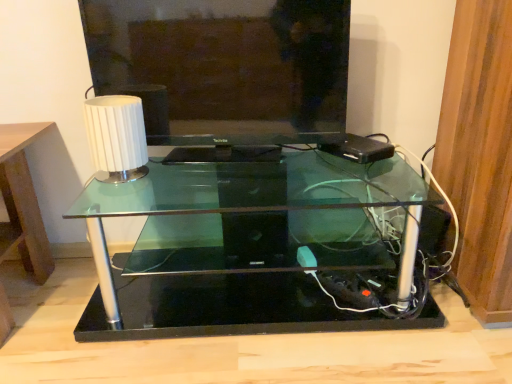
Question: Could you tell me if transparent glass table at center is facing white ribbed lampshade at upper left?

Choices:
 (A) yes
 (B) no

Answer: (B)

Question: From the image's perspective, is transparent glass table at center under white ribbed lampshade at upper left?

Choices:
 (A) no
 (B) yes

Answer: (B)

Question: Is the position of transparent glass table at center more distant than that of white ribbed lampshade at upper left?

Choices:
 (A) no
 (B) yes

Answer: (A)

Question: Can you confirm if transparent glass table at center is thinner than white ribbed lampshade at upper left?

Choices:
 (A) no
 (B) yes

Answer: (A)

Question: Is white ribbed lampshade at upper left at the back of transparent glass table at center?

Choices:
 (A) no
 (B) yes

Answer: (A)

Question: Is white ribbed lampshade at upper left inside transparent glass table at center?

Choices:
 (A) no
 (B) yes

Answer: (A)

Question: Would you say matte black television at center is outside transparent glass table at center?

Choices:
 (A) yes
 (B) no

Answer: (A)

Question: Does matte black television at center have a larger size compared to transparent glass table at center?

Choices:
 (A) no
 (B) yes

Answer: (A)

Question: Is matte black television at center not near transparent glass table at center?

Choices:
 (A) yes
 (B) no

Answer: (B)

Question: Can you confirm if matte black television at center is positioned to the right of transparent glass table at center?

Choices:
 (A) yes
 (B) no

Answer: (B)

Question: Could transparent glass table at center be considered to be inside matte black television at center?

Choices:
 (A) yes
 (B) no

Answer: (B)

Question: Is matte black television at center oriented away from transparent glass table at center?

Choices:
 (A) no
 (B) yes

Answer: (A)

Question: From the image's perspective, is matte black television at center located beneath white ribbed lampshade at upper left?

Choices:
 (A) yes
 (B) no

Answer: (B)